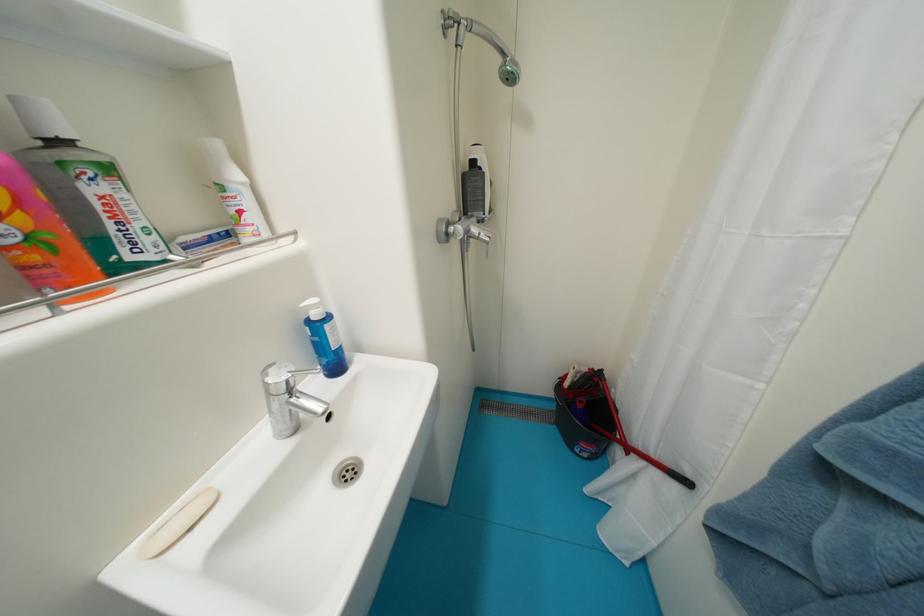
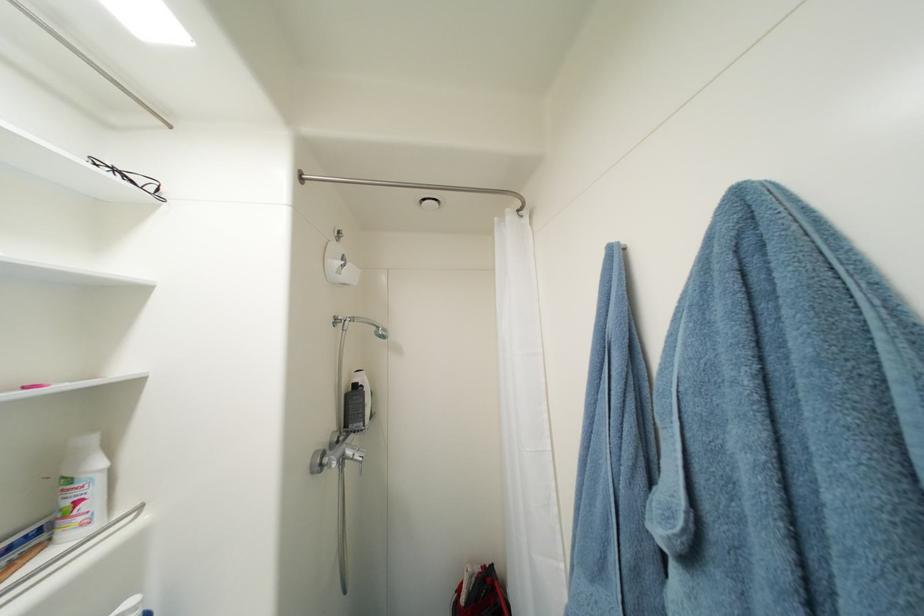
In the second image, find the point that corresponds to point 481,231 in the first image.

(356, 454)